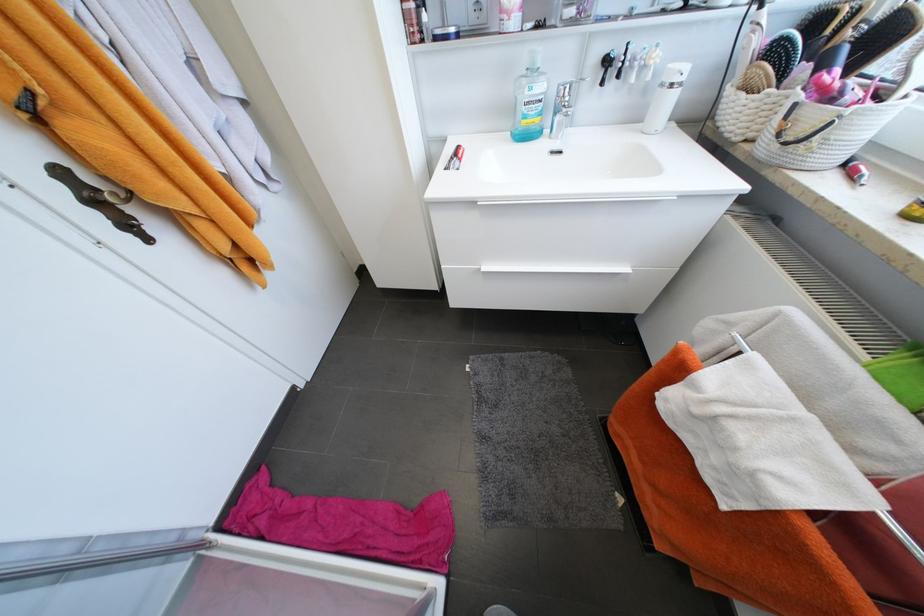
This screenshot has width=924, height=616. I want to click on dark door handle, so click(105, 206).